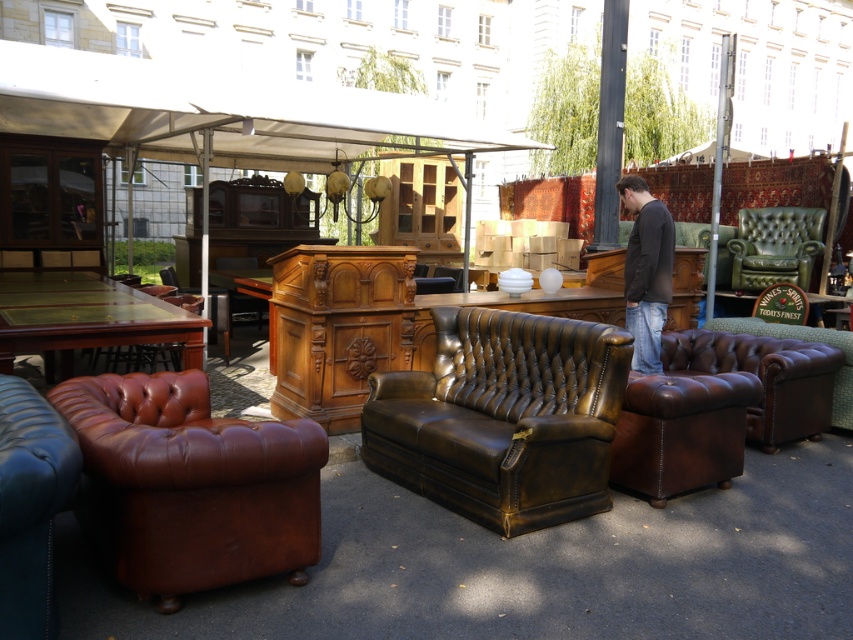
Question: Which object is closer to the camera taking this photo?

Choices:
 (A) matte blue leather couch at lower left
 (B) green leather armchair at right
 (C) dark gray sweater at center

Answer: (A)

Question: Which point is farther to the camera?

Choices:
 (A) (822, 218)
 (B) (454, 284)
 (C) (535, 360)

Answer: (A)

Question: Which object is the farthest from the matte blue leather couch at lower left?

Choices:
 (A) dark gray sweater at center
 (B) brown leather couch at center
 (C) brown leather armchair at center

Answer: (C)

Question: Is green leather armchair at right bigger than green fabric couch at right?

Choices:
 (A) no
 (B) yes

Answer: (B)

Question: Does matte blue leather couch at lower left have a larger size compared to dark gray sweater at center?

Choices:
 (A) no
 (B) yes

Answer: (B)

Question: From the image, what is the correct spatial relationship of green polished wood table at left in relation to green leather armchair at right?

Choices:
 (A) above
 (B) below

Answer: (B)